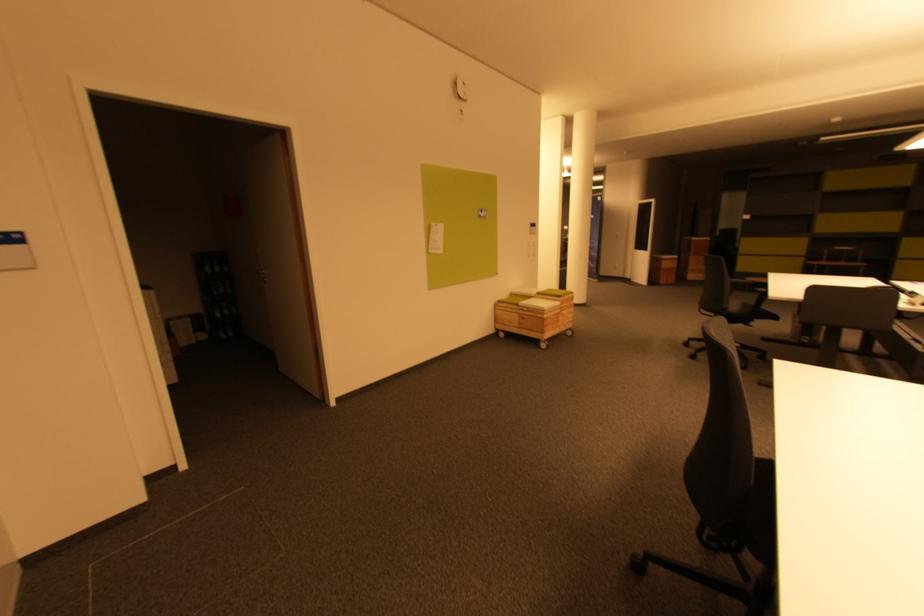
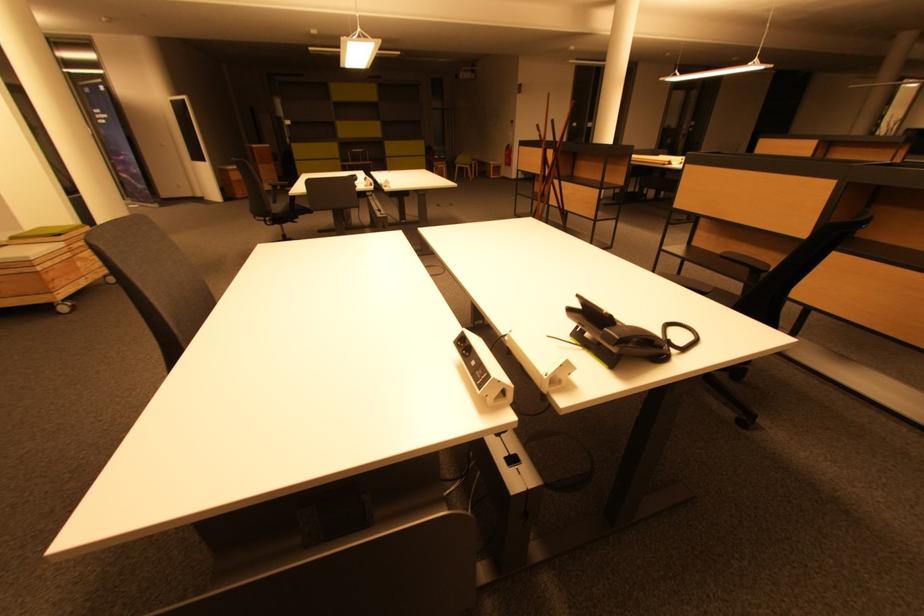
Find the pixel in the second image that matches (565,320) in the first image.

(83, 265)